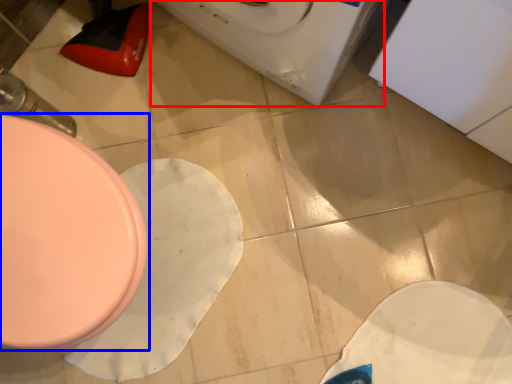
Question: Among these objects, which one is farthest to the camera, washing machine (highlighted by a red box) or toilet (highlighted by a blue box)?

Choices:
 (A) washing machine
 (B) toilet

Answer: (B)